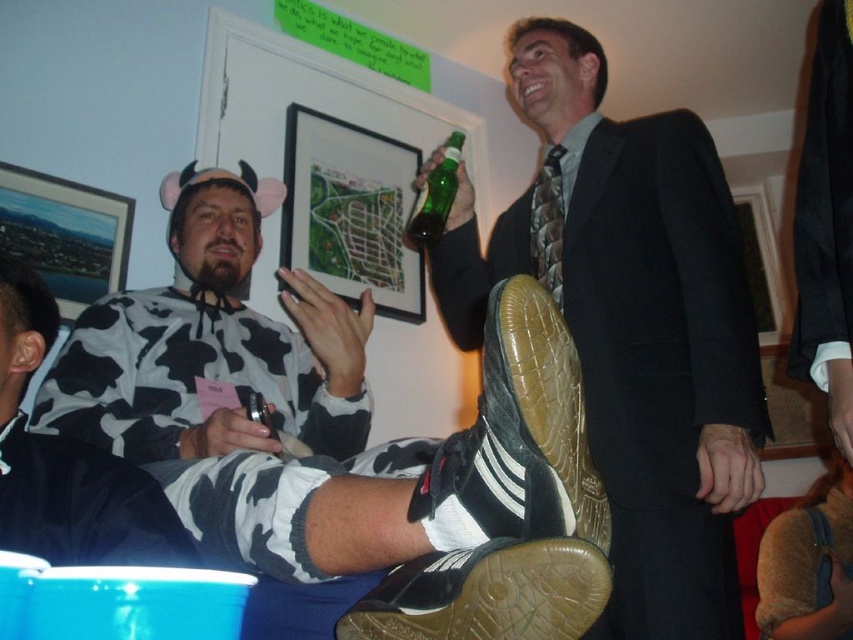
Who is positioned more to the right, black and white spotted shirt at lower left or green glass bottle at upper center?

From the viewer's perspective, green glass bottle at upper center appears more on the right side.

Is point (602, 596) closer to camera compared to point (460, 148)?

Yes, point (602, 596) is closer to viewer.

Find the location of a particular element. black and white spotted shirt at lower left is located at coordinates (347, 493).

Which of these two, cow print sweater at center or leather braided tie at upper center, stands taller?

Standing taller between the two is cow print sweater at center.

Between point (265, 378) and point (532, 246), which one is positioned in front?

Point (265, 378) is in front.

Locate an element on the screen. cow print sweater at center is located at coordinates (212, 342).

Does leather braided tie at upper center appear on the right side of green glass bottle at upper center?

Yes, leather braided tie at upper center is to the right of green glass bottle at upper center.

Which is in front, point (543, 234) or point (408, 237)?

Point (543, 234) is in front.

Where is `leather braided tie at upper center`? leather braided tie at upper center is located at coordinates tap(547, 225).

Locate an element on the screen. The height and width of the screenshot is (640, 853). leather braided tie at upper center is located at coordinates [x=547, y=225].